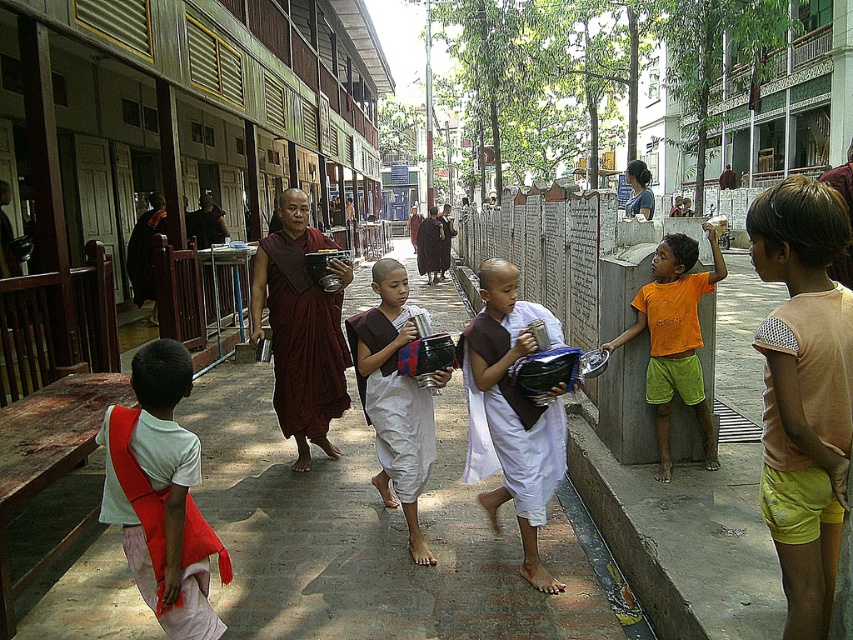
You are a tailor observing the white cotton shirt at lower left and the maroon silk robe at center. Which garment has a thicker material?

The maroon silk robe at center has a thicker material than the white cotton shirt at lower left according to the description.